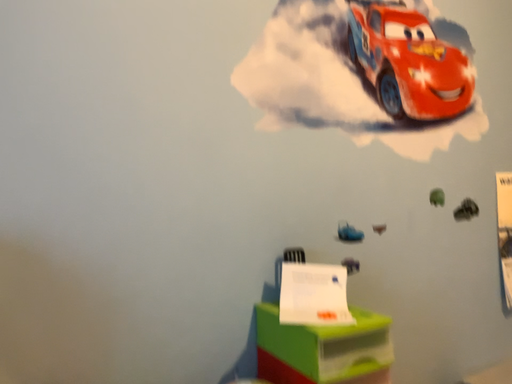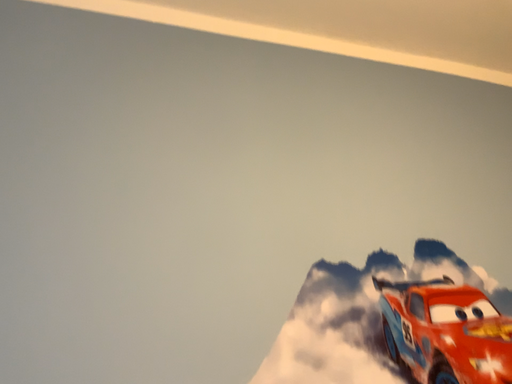
Question: Which way did the camera rotate in the video?

Choices:
 (A) rotated left
 (B) rotated right

Answer: (A)